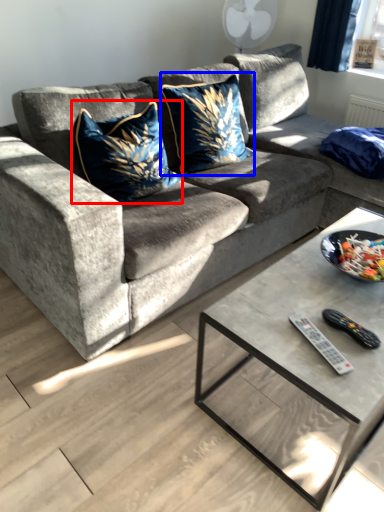
Question: Which point is closer to the camera, throw pillow (highlighted by a red box) or throw pillow (highlighted by a blue box)?

Choices:
 (A) throw pillow
 (B) throw pillow

Answer: (A)